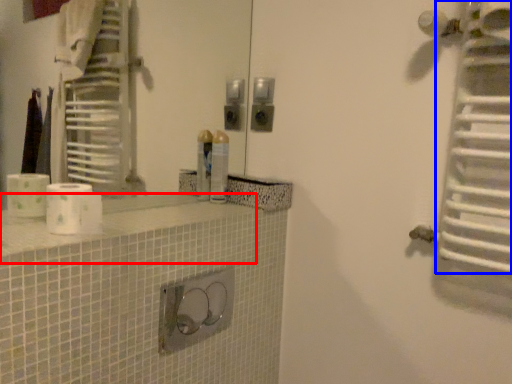
Question: Which object appears closest to the camera in this image, counter top (highlighted by a red box) or radiator (highlighted by a blue box)?

Choices:
 (A) counter top
 (B) radiator

Answer: (A)